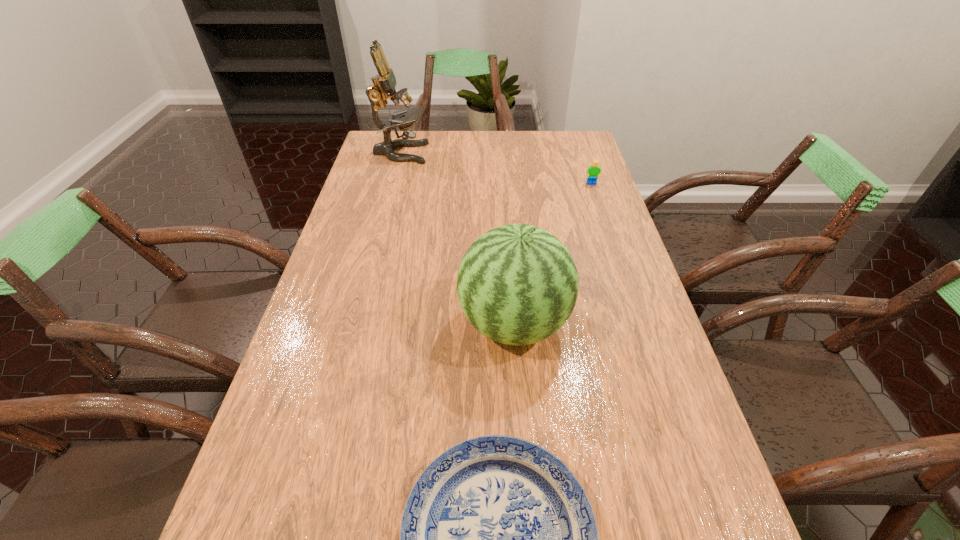
I want to click on microscope, so click(384, 83).

You are a GUI agent. You are given a task and a screenshot of the screen. Output one action in this format:
    pyautogui.click(x=<x>, y=<y>)
    Task: Click on the tallest object
    This screenshot has height=540, width=960.
    Given the screenshot: What is the action you would take?
    pyautogui.click(x=384, y=83)

This screenshot has width=960, height=540. I want to click on watermelon, so coord(517,284).

Where is `the second nearest object`? the second nearest object is located at coordinates (517, 284).

Where is `the third nearest object`? the third nearest object is located at coordinates (593, 171).

Where is `Lego`? The height and width of the screenshot is (540, 960). Lego is located at coordinates (593, 171).

You are a GUI agent. You are given a task and a screenshot of the screen. Output one action in this format:
    pyautogui.click(x=<x>, y=<y>)
    Task: Click on the blank area located 0.210m at the eyepieces of the farthest object
    The image size is (960, 540).
    Given the screenshot: What is the action you would take?
    pyautogui.click(x=485, y=153)

Find the location of a particular element. The height and width of the screenshot is (540, 960). vacant area located on the front of the watermelon is located at coordinates (527, 500).

Locate an element on the screen. Image resolution: width=960 pixels, height=540 pixels. free space located 0.200m on the face of the second shortest object is located at coordinates (605, 223).

The image size is (960, 540). I want to click on object positioned at the far edge, so (x=384, y=83).